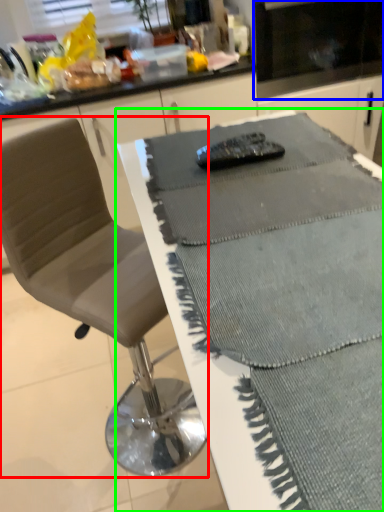
Question: Which is nearer to the chair (highlighted by a red box)? appliance (highlighted by a blue box) or table (highlighted by a green box).

Choices:
 (A) appliance
 (B) table

Answer: (B)